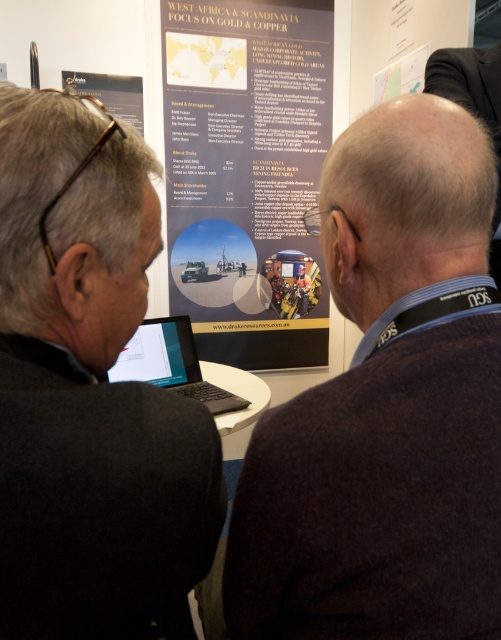
Is matte gold poster at center to the left of matte black laptop at center from the viewer's perspective?

In fact, matte gold poster at center is to the right of matte black laptop at center.

Does point (207, 44) lie in front of point (153, 368)?

That is False.

The width and height of the screenshot is (501, 640). I want to click on matte gold poster at center, so click(x=247, y=173).

Who is higher up, dark brown wool coat at center or matte black laptop at center?

Positioned higher is dark brown wool coat at center.

Can you confirm if dark brown wool coat at center is positioned to the left of matte black laptop at center?

In fact, dark brown wool coat at center is to the right of matte black laptop at center.

Where is `dark brown wool coat at center`? dark brown wool coat at center is located at coordinates (385, 408).

Does point (247, 269) come farther from viewer compared to point (115, 365)?

That is True.

Can you confirm if matte gold poster at center is smaller than black matte laptop at center?

No, matte gold poster at center is not smaller than black matte laptop at center.

At what (x,y) coordinates should I click in order to perform the action: click on matte gold poster at center. Please return your answer as a coordinate pair (x, y). The width and height of the screenshot is (501, 640). Looking at the image, I should click on (247, 173).

You are a GUI agent. You are given a task and a screenshot of the screen. Output one action in this format:
    pyautogui.click(x=<x>, y=<y>)
    Task: Click on the matte gold poster at center
    
    Given the screenshot: What is the action you would take?
    pyautogui.click(x=247, y=173)